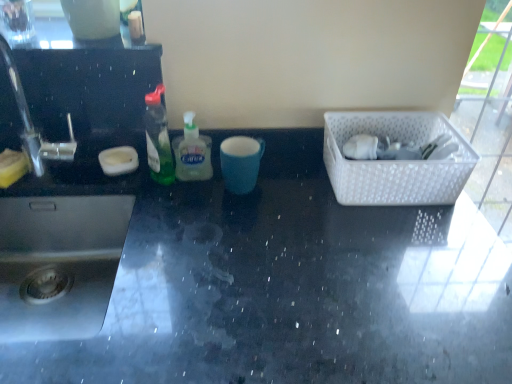
The height and width of the screenshot is (384, 512). I want to click on vacant space in front of green translucent bottle at center, acting as the 2th bottle starting from the right, so click(x=168, y=215).